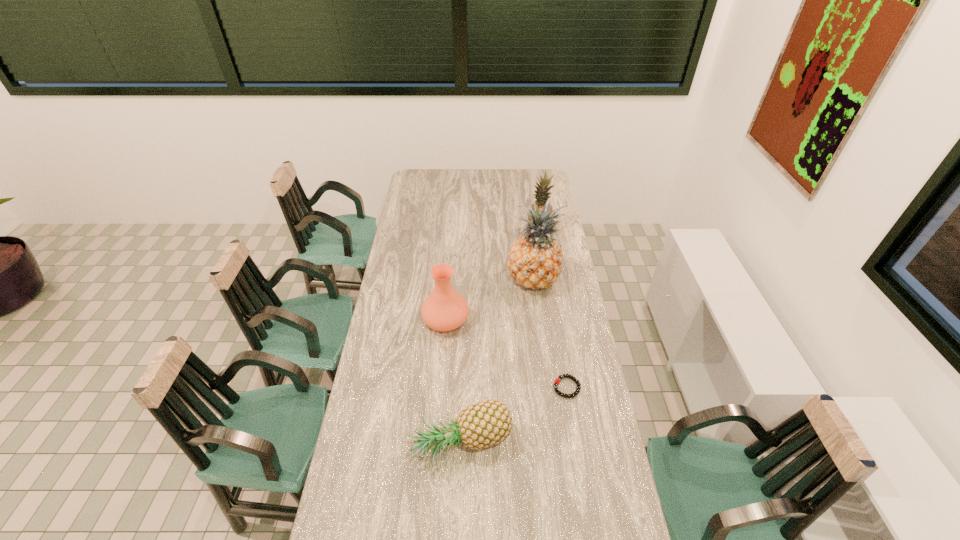
Where is `vacant area situated 0.180m on the front of the second tallest object`? vacant area situated 0.180m on the front of the second tallest object is located at coordinates (543, 264).

I want to click on free spot located 0.170m on the right of the third farthest object, so coord(511,320).

Find the location of a particular element. The image size is (960, 540). blank area located on the right of the nearest pineapple is located at coordinates (548, 448).

Where is `vacant region located 0.250m on the back of the bracelet`? vacant region located 0.250m on the back of the bracelet is located at coordinates (556, 323).

At what (x,y) coordinates should I click in order to perform the action: click on bracelet that is positioned at the right edge. Please return your answer as a coordinate pair (x, y). This screenshot has width=960, height=540. Looking at the image, I should click on (557, 380).

Locate an element on the screen. The width and height of the screenshot is (960, 540). free region at the far edge of the desktop is located at coordinates (453, 169).

Find the location of `vacant space at the left edge of the desktop`. vacant space at the left edge of the desktop is located at coordinates (383, 499).

At what (x,y) coordinates should I click in order to perform the action: click on vacant area at the right edge. Please return your answer as a coordinate pair (x, y). Looking at the image, I should click on (553, 296).

The image size is (960, 540). In the image, there is a desktop. Find the location of `free space at the far left corner`. free space at the far left corner is located at coordinates (434, 176).

Identify the location of vacant space that is in between the third tallest object and the fourth farthest object. The width and height of the screenshot is (960, 540). (506, 354).